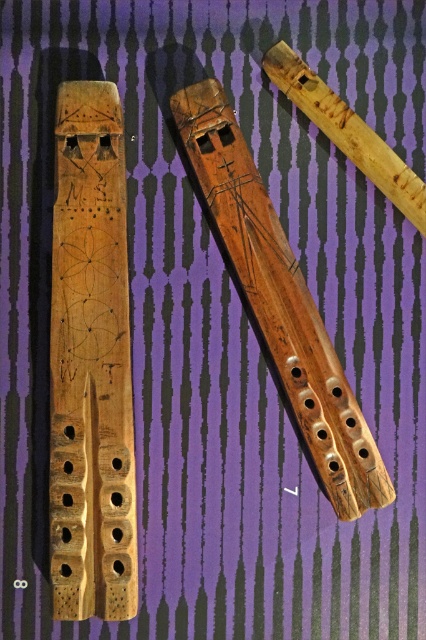
Does natural wood flute at left appear under natural wood flute at center?

Correct, natural wood flute at left is located below natural wood flute at center.

Identify the location of natural wood flute at left. The width and height of the screenshot is (426, 640). (91, 364).